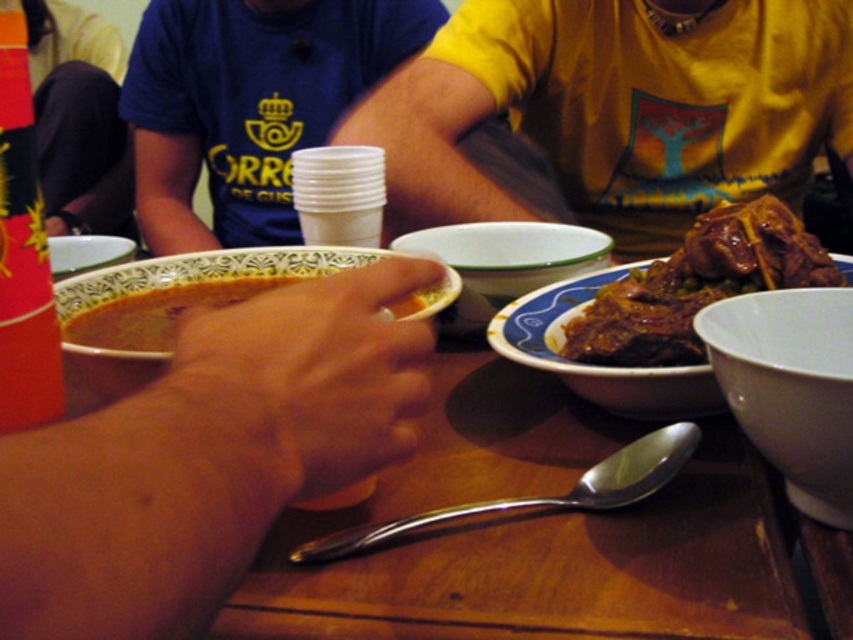
Between brown glossy meat at right and matte ceramic bowl at upper left, which one appears on the right side from the viewer's perspective?

Positioned to the right is brown glossy meat at right.

Which is behind, point (651, 285) or point (68, 236)?

Point (68, 236)

The image size is (853, 640). What are the coordinates of `brown glossy meat at right` in the screenshot? It's located at (697, 285).

Locate an element on the screen. dark blue t-shirt at upper center is located at coordinates (79, 120).

Between point (68, 51) and point (55, 275), which one is positioned in front?

Positioned in front is point (55, 275).

Identify the location of dark blue t-shirt at upper center. The image size is (853, 640). (79, 120).

Is point (57, 381) in front of point (408, 248)?

Yes.

Based on the photo, is red matte cup at left wider than white glossy bowl at center?

No, red matte cup at left is not wider than white glossy bowl at center.

Between point (15, 273) and point (525, 292), which one is positioned behind?

The point (525, 292) is behind.

You are a GUI agent. You are given a task and a screenshot of the screen. Output one action in this format:
    pyautogui.click(x=<x>, y=<y>)
    Task: Click on the red matte cup at left
    The image size is (853, 640).
    Given the screenshot: What is the action you would take?
    pyautogui.click(x=22, y=250)